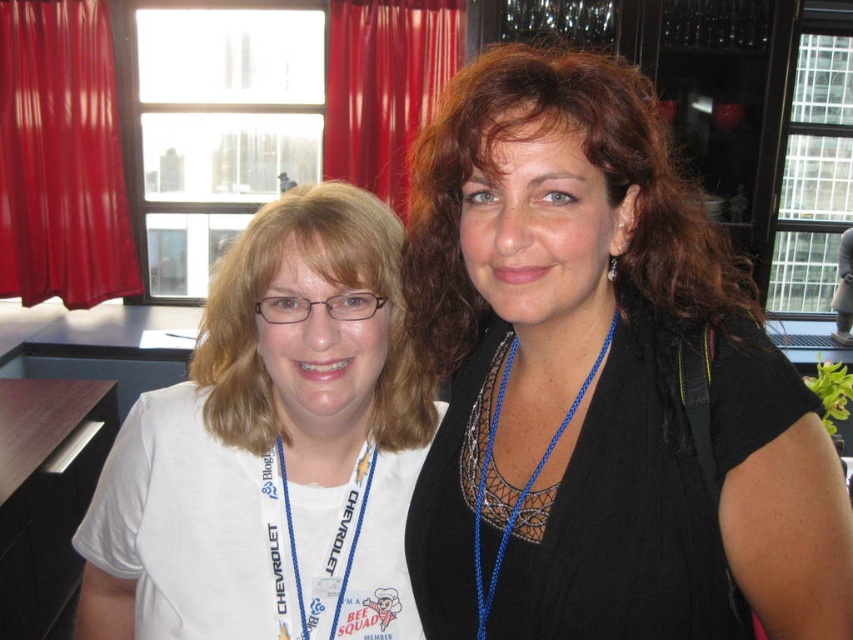
Based on the photo, can you confirm if white cotton shirt at center is positioned to the left of blue braided lanyard at center?

Yes, white cotton shirt at center is to the left of blue braided lanyard at center.

Which is more to the left, white cotton shirt at center or blue braided lanyard at center?

Positioned to the left is white cotton shirt at center.

Does point (125, 436) come farther from viewer compared to point (477, 577)?

Yes, point (125, 436) is farther from viewer.

At what (x,y) coordinates should I click in order to perform the action: click on white cotton shirt at center. Please return your answer as a coordinate pair (x, y). This screenshot has height=640, width=853. Looking at the image, I should click on (271, 445).

Does point (592, 602) come in front of point (605, 355)?

Yes, it is.

Which is below, black mesh top at center or blue braided lanyard at center?

Positioned lower is blue braided lanyard at center.

Does point (595, 72) come in front of point (602, 339)?

Yes, it is in front of point (602, 339).

The width and height of the screenshot is (853, 640). I want to click on black mesh top at center, so click(601, 381).

Measure the distance from red velvet curtain at upper center to blue braided lanyard at center.

red velvet curtain at upper center and blue braided lanyard at center are 2.31 meters apart from each other.

Does red velvet curtain at upper center appear under blue braided lanyard at center?

Actually, red velvet curtain at upper center is above blue braided lanyard at center.

Where is `red velvet curtain at upper center`? This screenshot has width=853, height=640. red velvet curtain at upper center is located at coordinates 384,84.